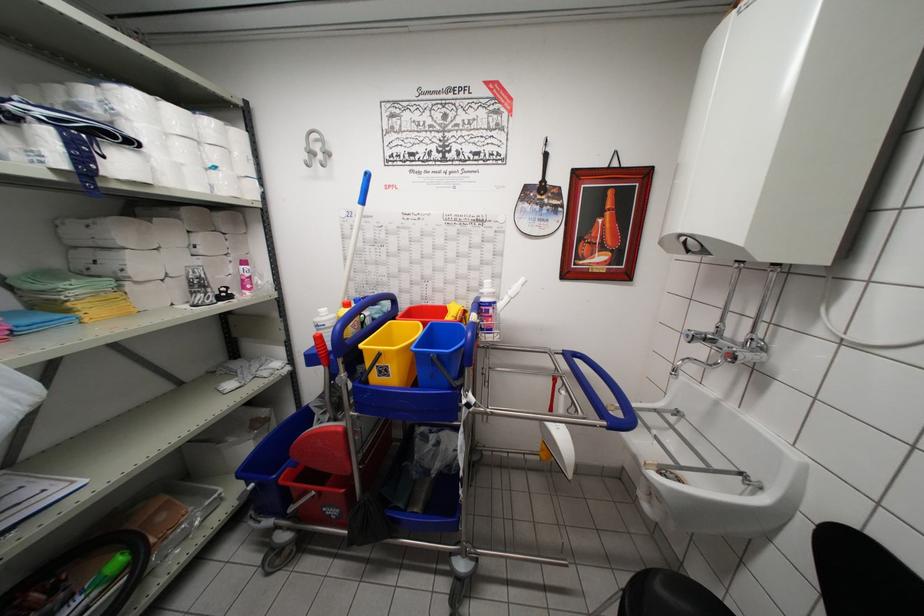
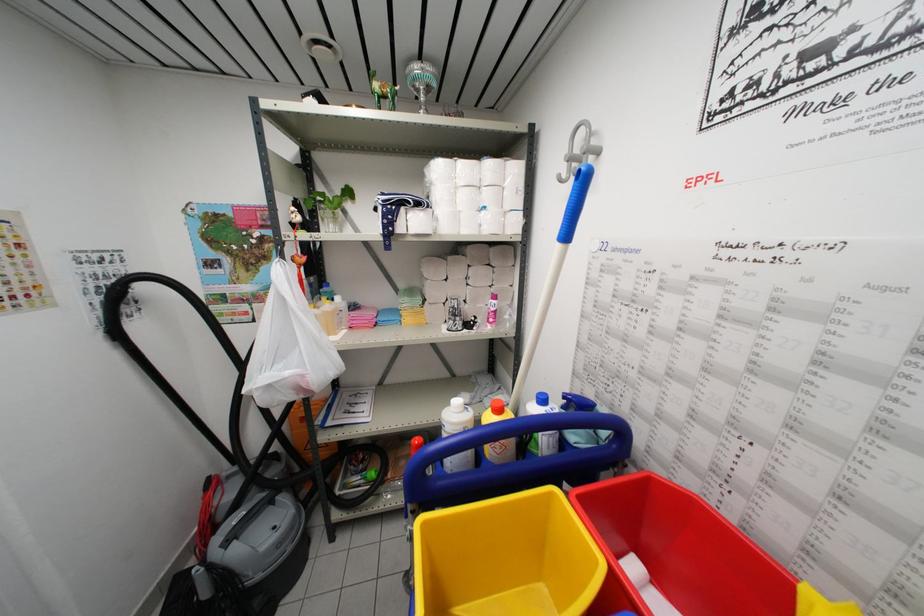
Find the pixel in the second image that matches pixel 331 152 in the first image.

(597, 148)